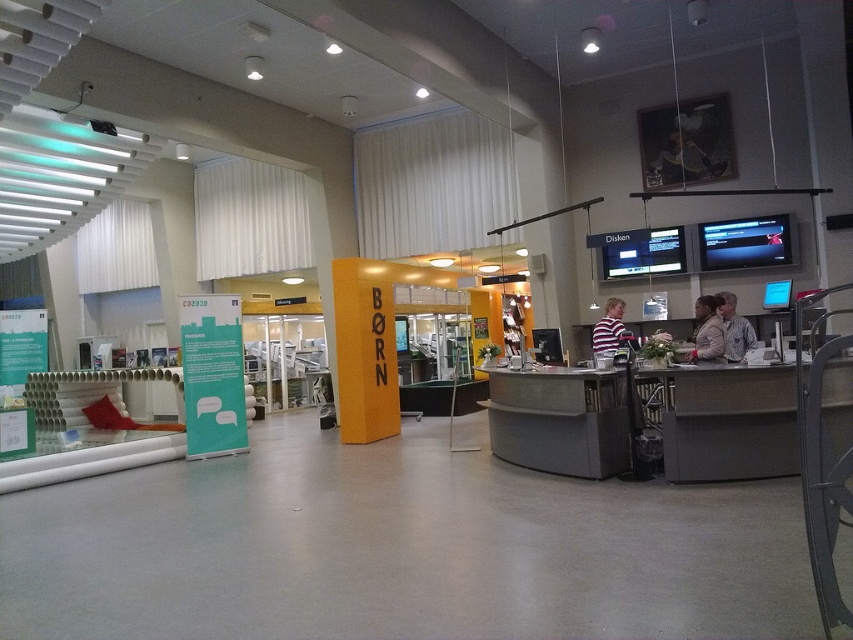
Question: Is metallic gray desk at center above matte gray desk at center?

Choices:
 (A) yes
 (B) no

Answer: (A)

Question: Which point is closer to the camera taking this photo?

Choices:
 (A) (704, 326)
 (B) (732, 307)
 (C) (564, 436)

Answer: (C)

Question: Which object is the farthest from the striped fabric shirt at center?

Choices:
 (A) leather jacket at center
 (B) light beige jacket at lower right

Answer: (A)

Question: Can you confirm if matte gray desk at center is positioned above striped fabric shirt at center?

Choices:
 (A) yes
 (B) no

Answer: (B)

Question: Which of the following is the closest to the observer?

Choices:
 (A) (746, 337)
 (B) (755, 477)

Answer: (B)

Question: Does metallic gray desk at center have a greater width compared to matte gray desk at center?

Choices:
 (A) no
 (B) yes

Answer: (B)